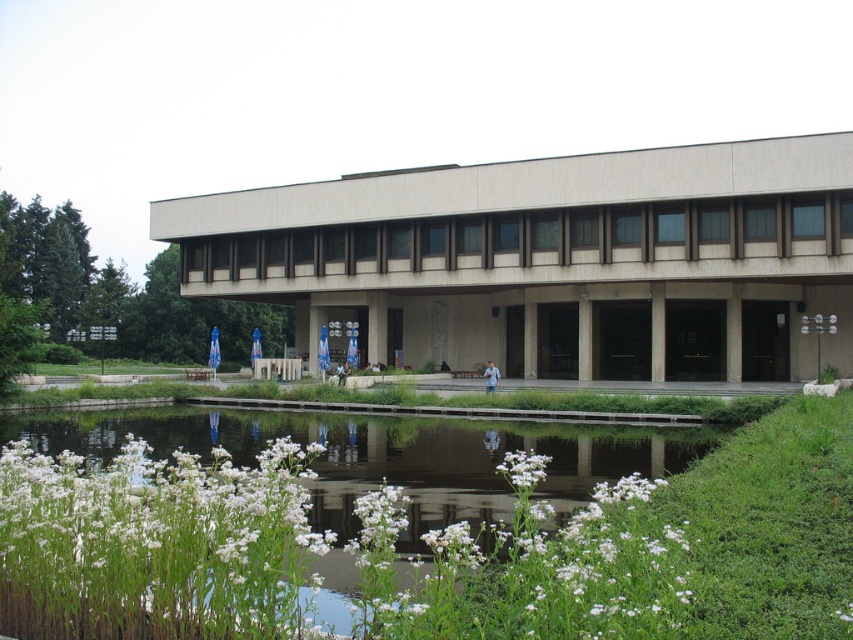
Question: Does beige concrete building at center lie in front of white soft grass at lower left?

Choices:
 (A) no
 (B) yes

Answer: (A)

Question: Which point is farther from the camera taking this photo?

Choices:
 (A) (453, 525)
 (B) (178, 227)

Answer: (B)

Question: Can you confirm if beige concrete building at center is thinner than white soft grass at lower left?

Choices:
 (A) yes
 (B) no

Answer: (B)

Question: Which of the following is the closest to the observer?

Choices:
 (A) white soft grass at lower left
 (B) beige concrete building at center

Answer: (A)

Question: Where is beige concrete building at center located in relation to white soft grass at lower left in the image?

Choices:
 (A) right
 (B) left

Answer: (A)